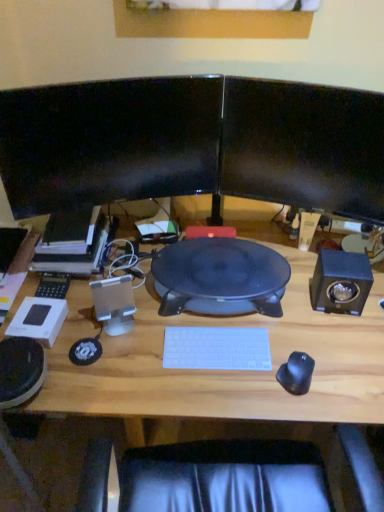
Question: From the image's perspective, is black glossy monitor at upper center, which ranks as the second computer monitor in left-to-right order, above satin black speaker at right, positioned as the second speaker in left-to-right order?

Choices:
 (A) no
 (B) yes

Answer: (B)

Question: Does black glossy monitor at upper center, arranged as the first computer monitor when viewed from the right, have a greater width compared to satin black speaker at right, positioned as the second speaker in left-to-right order?

Choices:
 (A) no
 (B) yes

Answer: (A)

Question: Is black glossy monitor at upper center, which ranks as the second computer monitor in left-to-right order, smaller than satin black speaker at right, positioned as the second speaker in left-to-right order?

Choices:
 (A) yes
 (B) no

Answer: (B)

Question: Considering the relative sizes of black glossy monitor at upper center, which ranks as the second computer monitor in left-to-right order, and satin black speaker at right, positioned as the second speaker in left-to-right order, in the image provided, is black glossy monitor at upper center, which ranks as the second computer monitor in left-to-right order, taller than satin black speaker at right, positioned as the second speaker in left-to-right order,?

Choices:
 (A) no
 (B) yes

Answer: (B)

Question: Is the position of black glossy monitor at upper center, arranged as the first computer monitor when viewed from the right, more distant than that of satin black speaker at right, which ranks as the 1th speaker in right-to-left order?

Choices:
 (A) no
 (B) yes

Answer: (A)

Question: Looking at the image, does silver metallic speaker at left, placed as the 2th speaker when sorted from right to left, seem bigger or smaller compared to black glossy monitor at upper left, acting as the first computer monitor starting from the left?

Choices:
 (A) small
 (B) big

Answer: (A)

Question: Is silver metallic speaker at left, placed as the 2th speaker when sorted from right to left, in front of or behind black glossy monitor at upper left, acting as the first computer monitor starting from the left, in the image?

Choices:
 (A) behind
 (B) front

Answer: (A)

Question: From a real-world perspective, is silver metallic speaker at left, marked as the first speaker in a left-to-right arrangement, positioned above or below black glossy monitor at upper left, which is the 2th computer monitor in right-to-left order?

Choices:
 (A) above
 (B) below

Answer: (B)

Question: Does point (130, 306) appear closer or farther from the camera than point (49, 209)?

Choices:
 (A) closer
 (B) farther

Answer: (A)

Question: Is silver metallic speaker at left, marked as the first speaker in a left-to-right arrangement, taller or shorter than satin black speaker at right, positioned as the second speaker in left-to-right order?

Choices:
 (A) short
 (B) tall

Answer: (B)

Question: From the image's perspective, relative to satin black speaker at right, which ranks as the 1th speaker in right-to-left order, is silver metallic speaker at left, marked as the first speaker in a left-to-right arrangement, above or below?

Choices:
 (A) above
 (B) below

Answer: (B)

Question: Would you say silver metallic speaker at left, placed as the 2th speaker when sorted from right to left, is inside or outside satin black speaker at right, which ranks as the 1th speaker in right-to-left order?

Choices:
 (A) inside
 (B) outside

Answer: (B)

Question: Is silver metallic speaker at left, marked as the first speaker in a left-to-right arrangement, in front of or behind satin black speaker at right, which ranks as the 1th speaker in right-to-left order, in the image?

Choices:
 (A) behind
 (B) front

Answer: (B)

Question: Relative to wooden desk at center, is black rubberized mouse at right in front or behind?

Choices:
 (A) front
 (B) behind

Answer: (B)

Question: Does point (292, 362) appear closer or farther from the camera than point (349, 487)?

Choices:
 (A) closer
 (B) farther

Answer: (B)